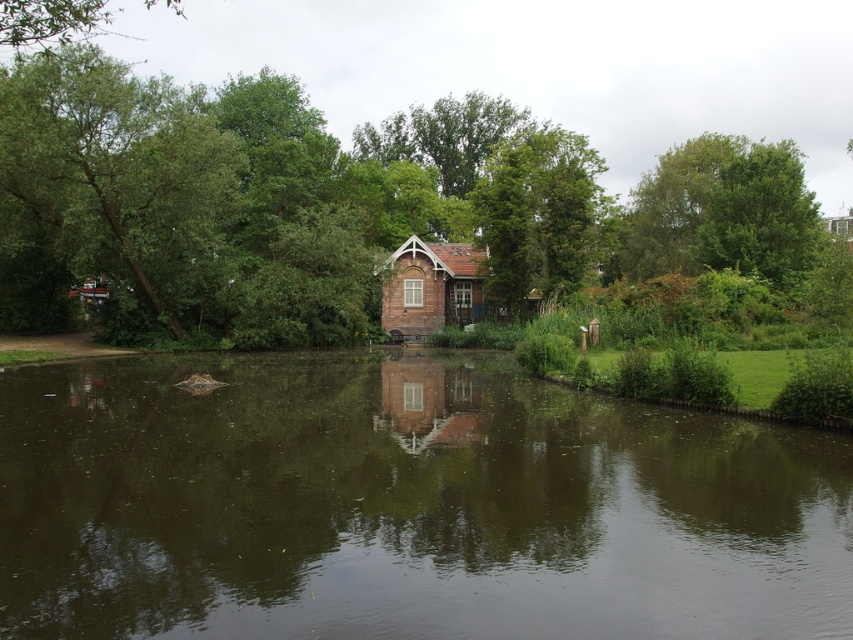
You are planning to take a photo of the brown brick cabin at center and the green leafy tree at center from a distance. Which object will appear wider in the photo?

The green leafy tree at center will appear wider in the photo because its width surpasses that of the brown brick cabin at center.

You are planning to build a small garden shed in this area. You want to ensure it doesn not block the view of the brown brick cabin at center from the green leafy tree at left. Given their heights, which object should be placed closer to the ground to maintain the view?

The green leafy tree at left is taller than the brown brick cabin at center. To maintain the view of the cabin from the tree, the green leafy tree at left should be placed closer to the ground so that its height does not obstruct the sightline.